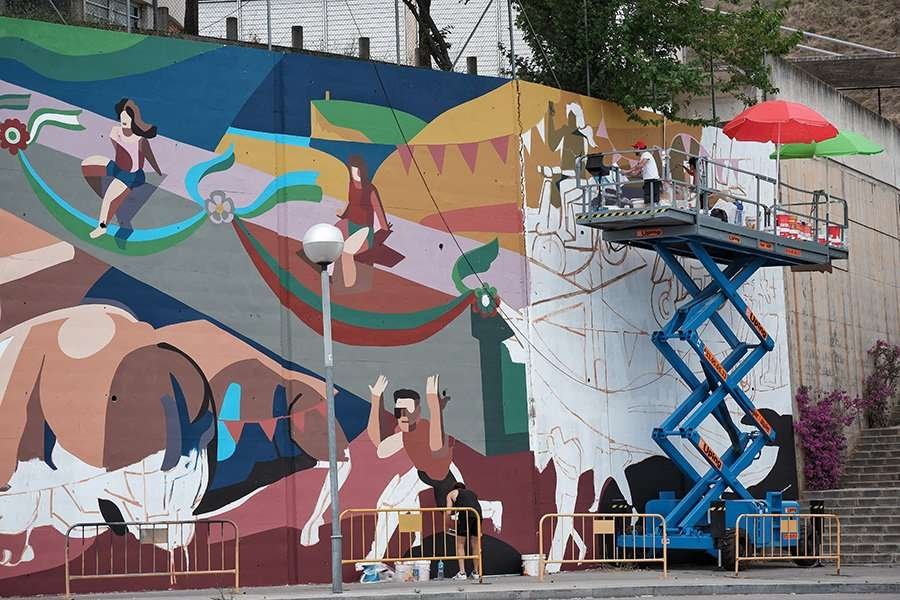
Find the location of a particular element. This screenshot has width=900, height=600. green paint is located at coordinates (110, 243).